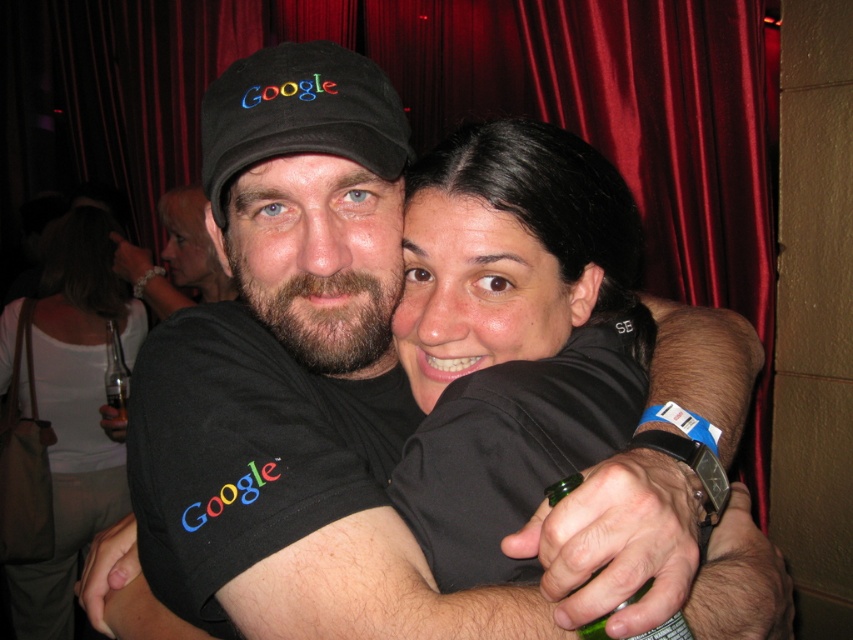
Can you confirm if white matte shirt at upper center is thinner than black fabric baseball cap at center?

In fact, white matte shirt at upper center might be wider than black fabric baseball cap at center.

Describe the element at coordinates (74, 412) in the screenshot. I see `white matte shirt at upper center` at that location.

Identify the location of white matte shirt at upper center. (74, 412).

Which is in front, point (64, 426) or point (202, 205)?

Point (64, 426) is in front.

Measure the distance between point (61, 579) and camera.

The distance of point (61, 579) from camera is 8.25 feet.

From the picture: Who is more distant from viewer, (51, 580) or (202, 300)?

The point (202, 300) is behind.

At what (x,y) coordinates should I click in order to perform the action: click on white matte shirt at upper center. Please return your answer as a coordinate pair (x, y). The height and width of the screenshot is (640, 853). Looking at the image, I should click on (74, 412).

Does black fabric baseball cap at center have a greater height compared to matte black shirt at center?

In fact, black fabric baseball cap at center may be shorter than matte black shirt at center.

Based on the photo, which is more to the right, black fabric baseball cap at center or matte black shirt at center?

From the viewer's perspective, black fabric baseball cap at center appears more on the right side.

Who is more forward, (260, 67) or (229, 296)?

Point (260, 67)

Image resolution: width=853 pixels, height=640 pixels. Find the location of `black fabric baseball cap at center`. black fabric baseball cap at center is located at coordinates (299, 115).